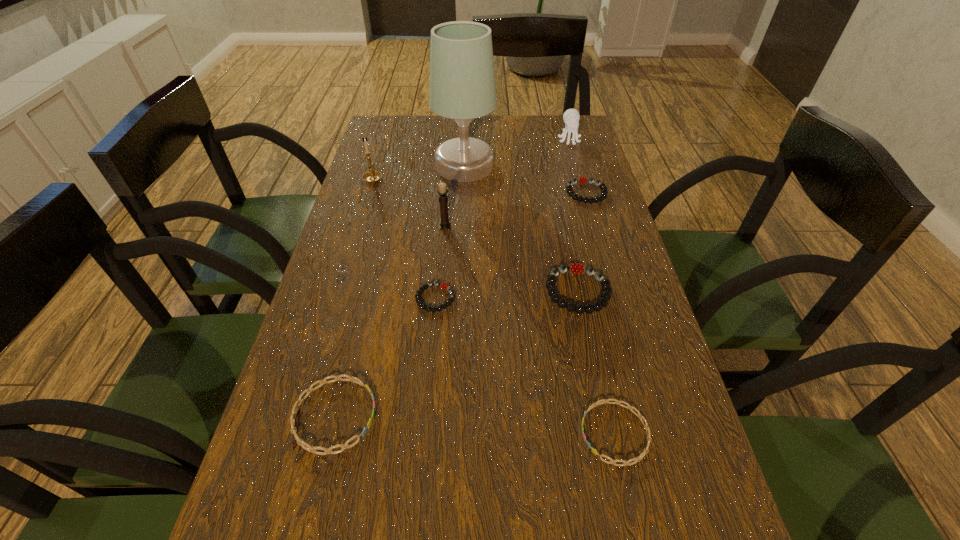
You are a GUI agent. You are given a task and a screenshot of the screen. Output one action in this format:
    pyautogui.click(x=<x>, y=<y>)
    Task: Click on the bracelet that stands as the fourth closest to the fourth bracelet from right to left
    The height and width of the screenshot is (540, 960).
    Given the screenshot: What is the action you would take?
    coord(604,190)

Locate which bracelet ranks fourth in proximity to the smallest black bracelet. Please provide its 2D coordinates. Your answer should be formatted as a tuple, i.e. [(x, y)], where the tuple contains the x and y coordinates of a point satisfying the conditions above.

[(604, 190)]

You are a GUI agent. You are given a task and a screenshot of the screen. Output one action in this format:
    pyautogui.click(x=<x>, y=<y>)
    Task: Click on the black bracelet that is the third closest one to the farther candle holder
    The width and height of the screenshot is (960, 540).
    Given the screenshot: What is the action you would take?
    pyautogui.click(x=576, y=268)

The width and height of the screenshot is (960, 540). Identify the location of black bracelet that is the nearest to the farthest black bracelet. (576, 268).

This screenshot has height=540, width=960. What are the coordinates of `blue bracelet that stands as the second closest to the farthest object` in the screenshot? It's located at (312, 449).

Where is `free space that satisfies the following two spatial constraints: 1. on the base of the second biggest black bracelet; 2. on the left side of the lampshade`? The width and height of the screenshot is (960, 540). free space that satisfies the following two spatial constraints: 1. on the base of the second biggest black bracelet; 2. on the left side of the lampshade is located at coordinates (464, 193).

Find the location of a particular element. This screenshot has width=960, height=540. free spot that satisfies the following two spatial constraints: 1. on the back side of the fifth shortest object; 2. on the base of the tallest object is located at coordinates (552, 166).

Locate an element on the screen. This screenshot has height=540, width=960. vacant region that satisfies the following two spatial constraints: 1. on the front-facing side of the white octopus; 2. on the surface of the leftmost bracelet showing star-shaped elements is located at coordinates (646, 415).

Identify the location of free spot that satisfies the following two spatial constraints: 1. on the base of the second biggest black bracelet; 2. on the left side of the gray lampshade. This screenshot has width=960, height=540. (464, 193).

Find the location of a particular element. This screenshot has height=540, width=960. free space that satisfies the following two spatial constraints: 1. on the front side of the smallest black bracelet; 2. on the surface of the left blue bracelet showing star-shaped elements is located at coordinates (424, 415).